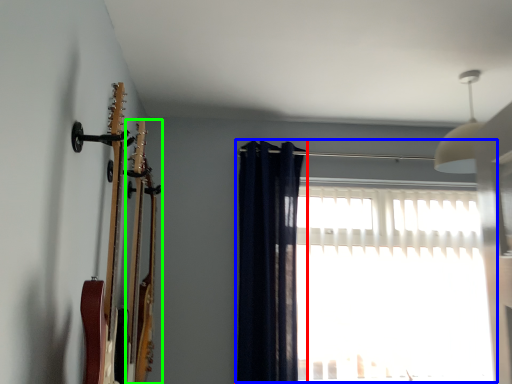
Question: Based on their relative distances, which object is farther from curtain (highlighted by a red box)? Choose from window (highlighted by a blue box) and guitar (highlighted by a green box).

Choices:
 (A) window
 (B) guitar

Answer: (B)